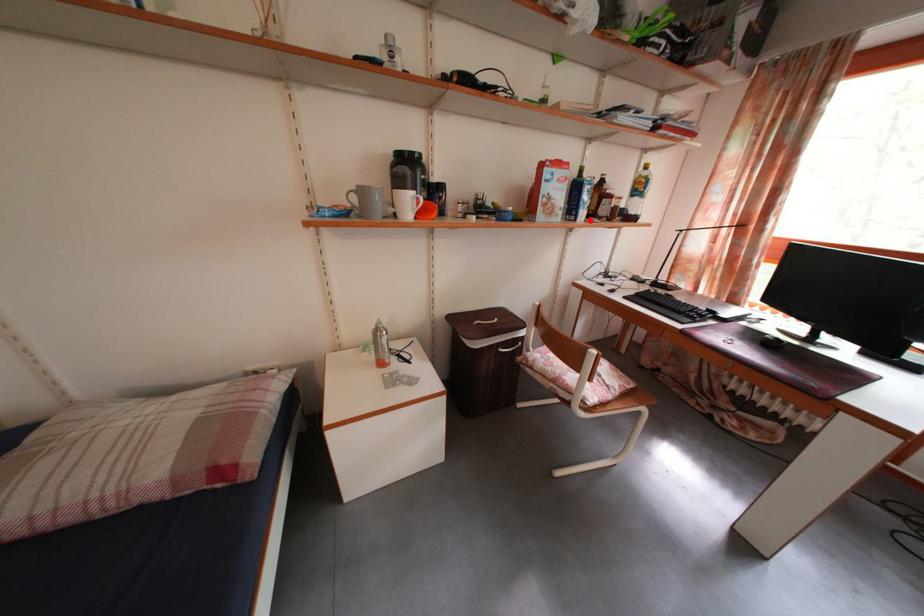
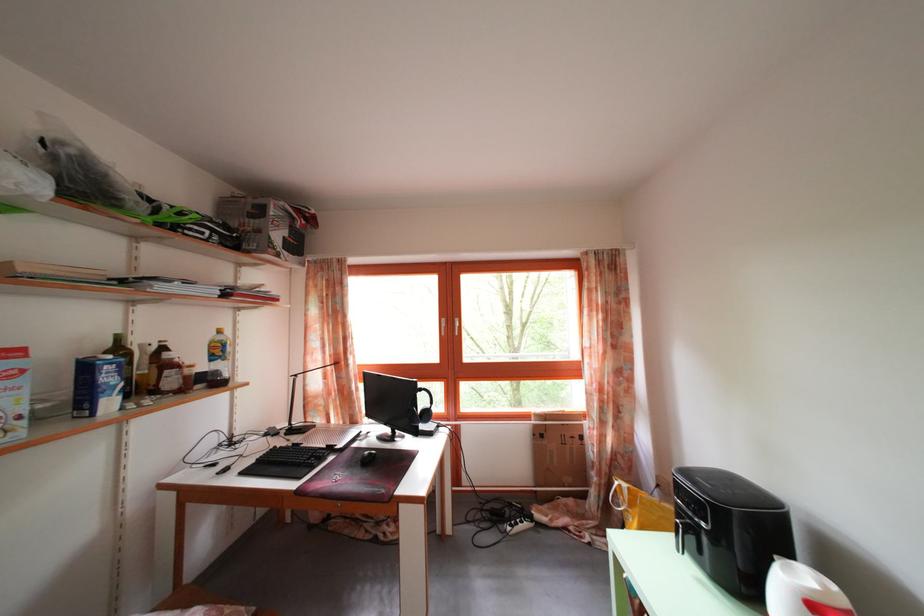
Find the pixel in the second image that matches the highlighted location in the first image.

(117, 410)